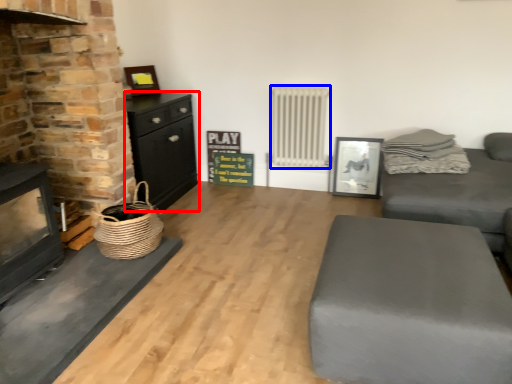
Question: Which of the following is the farthest to the observer, chest of drawers (highlighted by a red box) or radiator (highlighted by a blue box)?

Choices:
 (A) chest of drawers
 (B) radiator

Answer: (B)